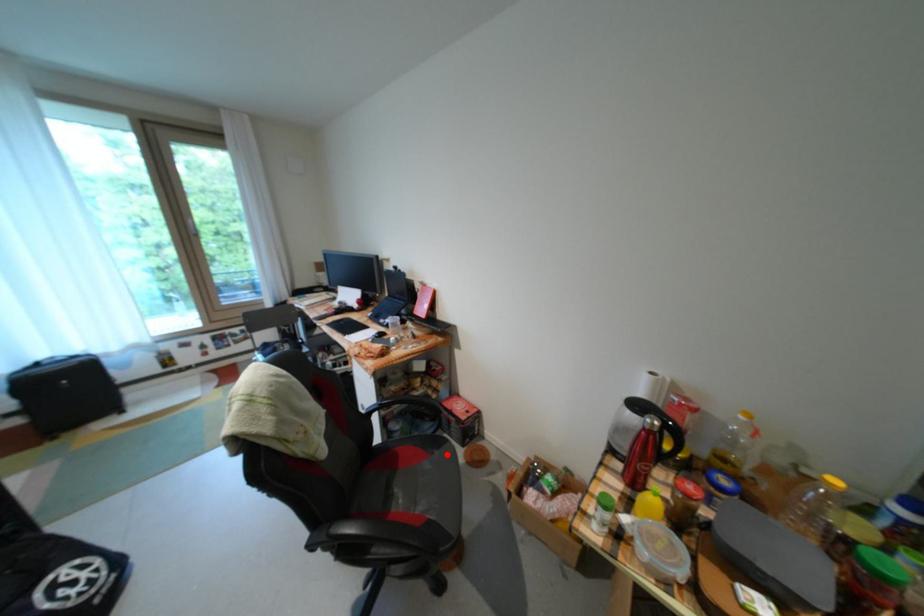
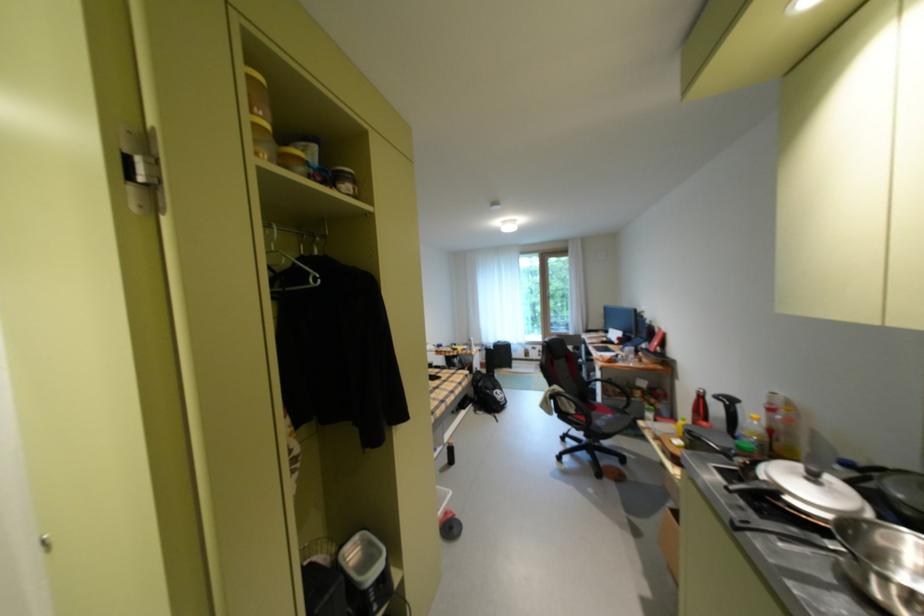
Question: I am providing you with two images of the same scene from different viewpoints. A red point is shown in image1. For the corresponding object point in image2, is it positioned nearer or farther from the camera?

Choices:
 (A) Nearer
 (B) Farther

Answer: (B)